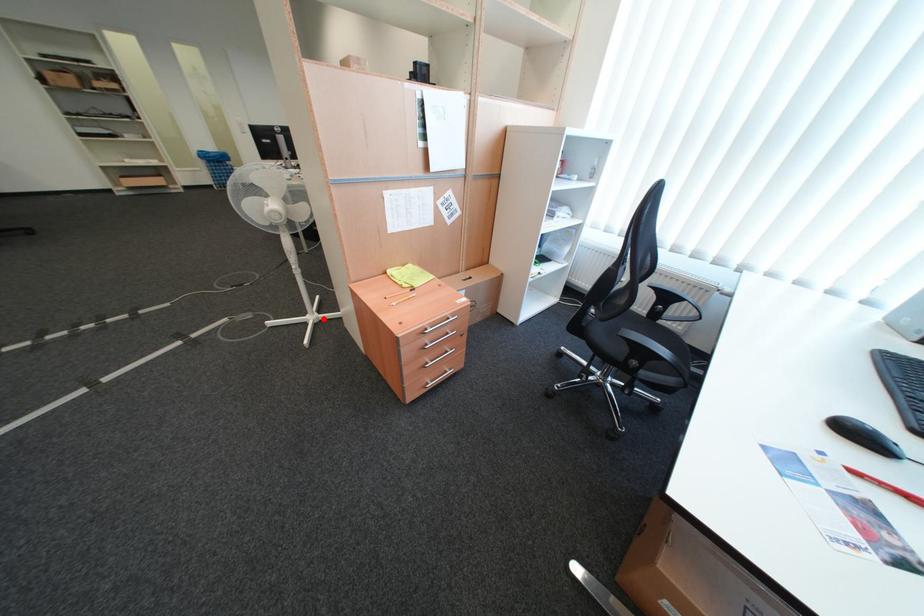
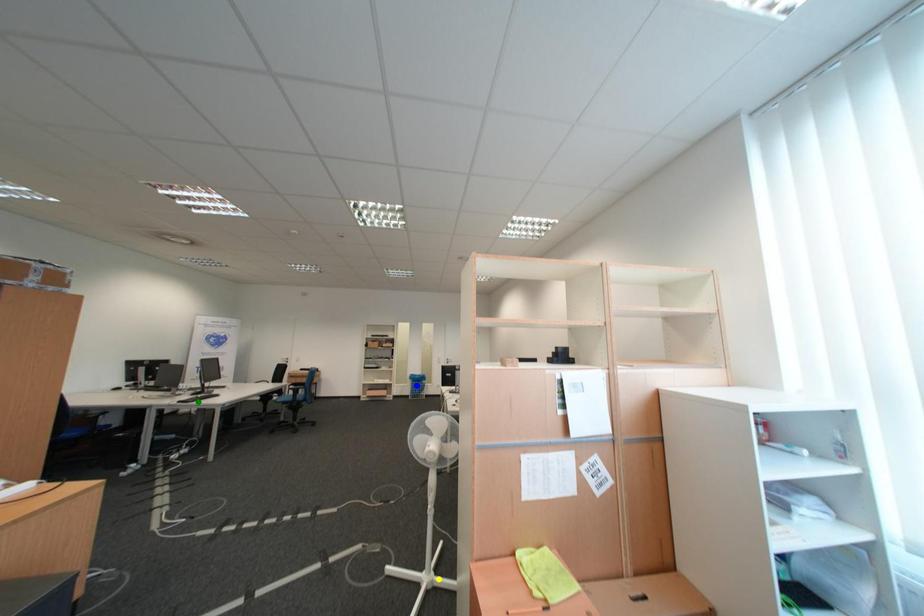
Question: I am providing you with two images of the same scene from different viewpoints. A red point is marked on the first image. You are given multiple points on the second image. Can you choose the point in image 2 that corresponds to the point in image 1?

Choices:
 (A) green point
 (B) blue point
 (C) yellow point

Answer: (C)